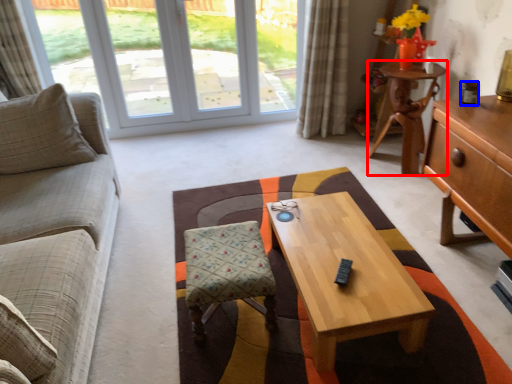
Question: Which of the following is the closest to the observer, desk (highlighted by a red box) or coffee cup (highlighted by a blue box)?

Choices:
 (A) desk
 (B) coffee cup

Answer: (B)